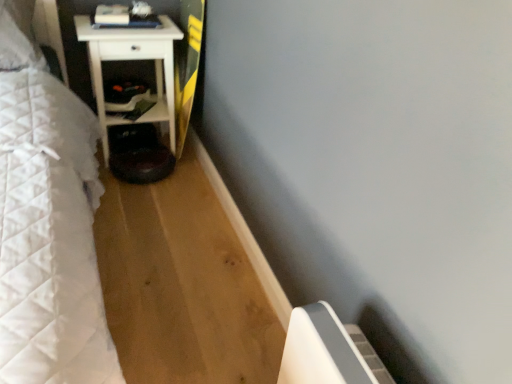
Locate an element on the screen. vacant area located to the right-hand side of shiny black step stool at lower center is located at coordinates (189, 180).